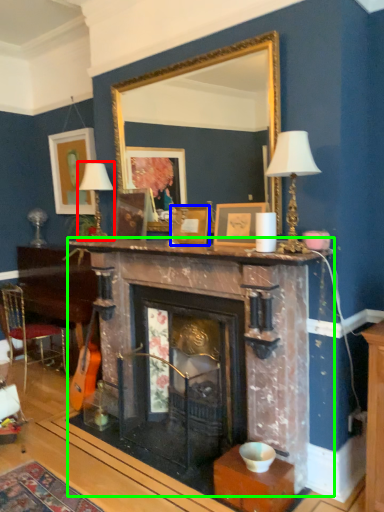
Question: Which object is the closest to the table lamp (highlighted by a red box)? Choose among these: picture frame (highlighted by a blue box) or fireplace (highlighted by a green box).

Choices:
 (A) picture frame
 (B) fireplace

Answer: (A)